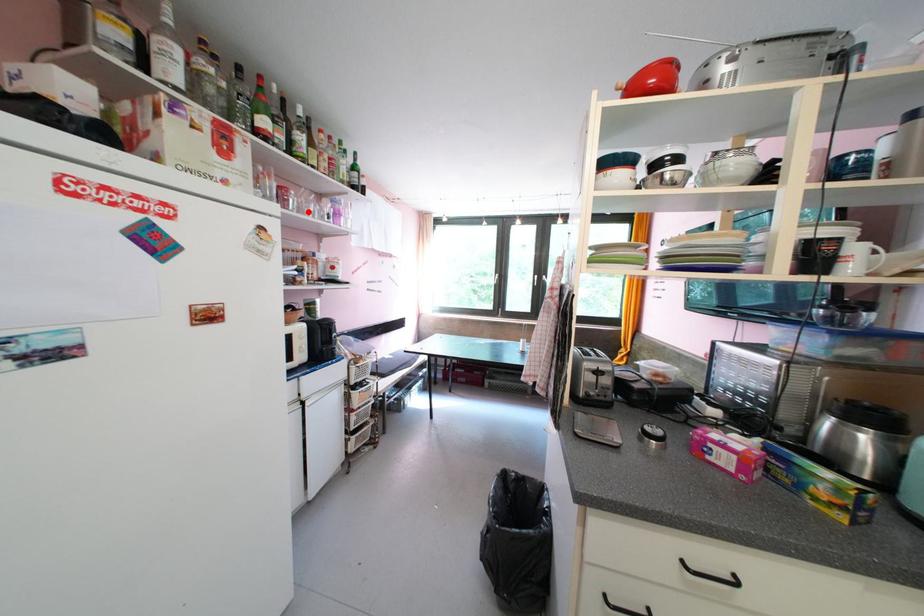
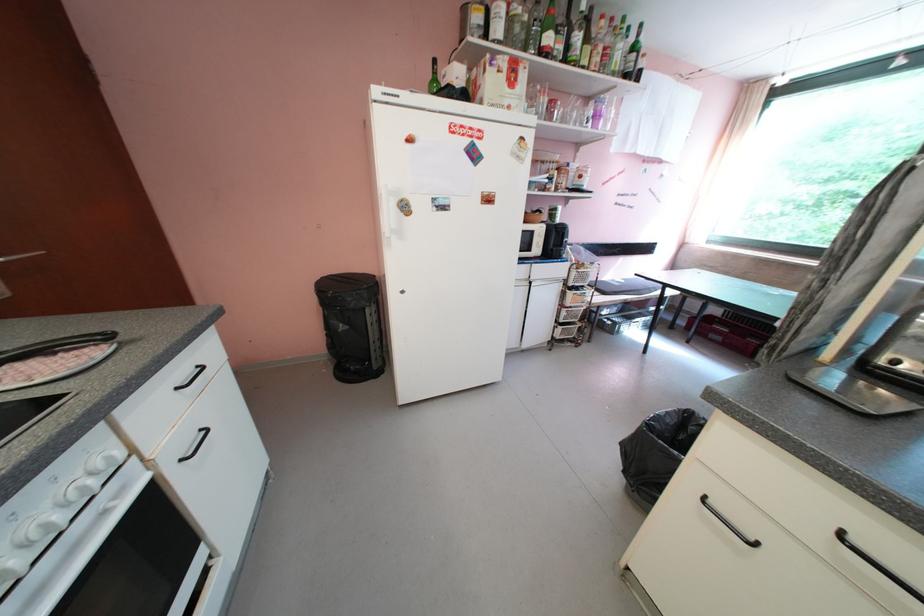
The point at the highlighted location is marked in the first image. Where is the corresponding point in the second image?

(572, 122)